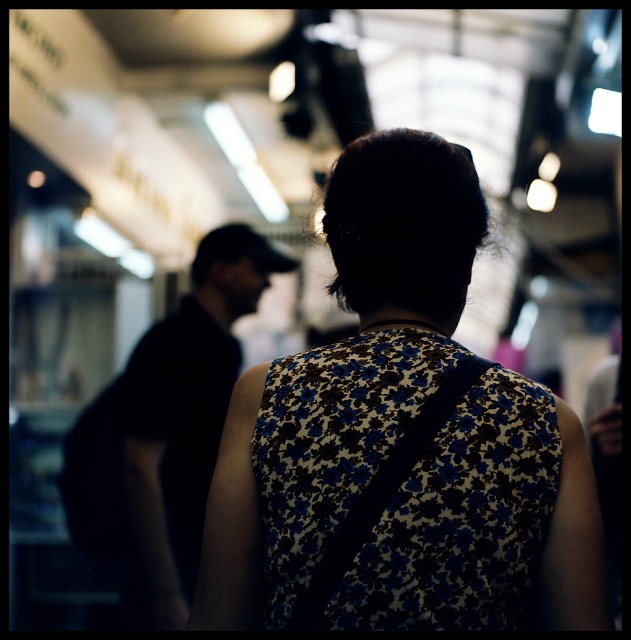
What do you see at coordinates (463, 520) in the screenshot? I see `floral-patterned fabric dress at center` at bounding box center [463, 520].

Image resolution: width=631 pixels, height=640 pixels. Identify the location of floral-patterned fabric dress at center. [x=463, y=520].

Find the location of `floral-patterned fabric dress at center`. floral-patterned fabric dress at center is located at coordinates (463, 520).

Between floral-patterned dress at center and black matte shirt at left, which one appears on the left side from the viewer's perspective?

black matte shirt at left

Is point (562, 616) positioned before point (182, 627)?

That is True.

This screenshot has height=640, width=631. In order to click on floral-patterned dress at center in this screenshot , I will do coord(341,376).

What are the coordinates of `floral-patterned dress at center` in the screenshot? It's located at (341, 376).

Is floral-patterned dress at center bigger than floral-patterned fabric dress at center?

Indeed, floral-patterned dress at center has a larger size compared to floral-patterned fabric dress at center.

Is point (572, 628) more distant than point (413, 570)?

That is False.

I want to click on floral-patterned dress at center, so click(x=341, y=376).